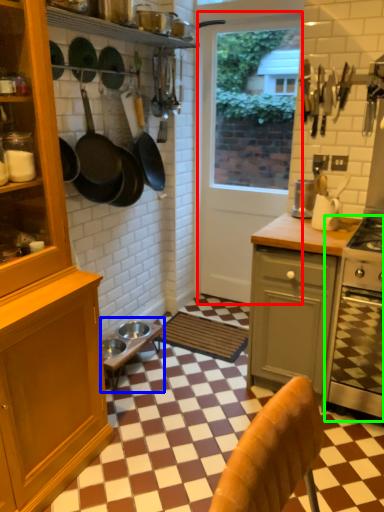
Question: Which is farther away from screen door (highlighted by a red box)? table (highlighted by a blue box) or oven (highlighted by a green box)?

Choices:
 (A) table
 (B) oven

Answer: (B)